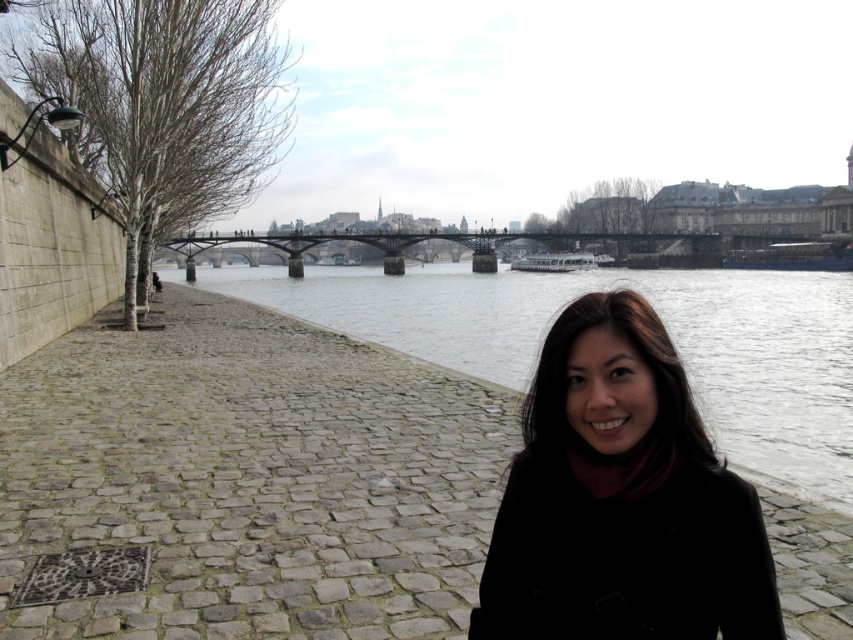
Does black woolen coat at center appear on the right side of metallic bridge at center?

In fact, black woolen coat at center is to the left of metallic bridge at center.

Is black woolen coat at center positioned at the back of metallic bridge at center?

That is False.

Find the location of a particular element. black woolen coat at center is located at coordinates (622, 502).

Between black woolen coat at center and gray concrete river at center, which one is positioned higher?

Positioned higher is gray concrete river at center.

Consider the image. Is black woolen coat at center thinner than gray concrete river at center?

Yes, black woolen coat at center is thinner than gray concrete river at center.

The height and width of the screenshot is (640, 853). I want to click on black woolen coat at center, so click(622, 502).

Find the location of a particular element. This screenshot has height=640, width=853. black woolen coat at center is located at coordinates (622, 502).

Who is more distant from viewer, (x=732, y=419) or (x=305, y=241)?

Positioned behind is point (x=305, y=241).

Is gray concrete river at center taller than metallic bridge at center?

Yes.

Is point (816, 304) in front of point (543, 236)?

Yes, it is in front of point (543, 236).

This screenshot has width=853, height=640. I want to click on gray concrete river at center, so click(x=659, y=316).